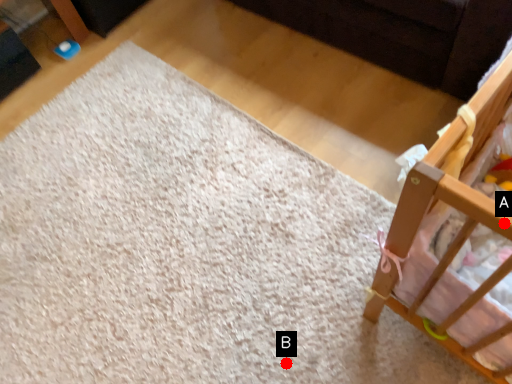
Question: Two points are circled on the image, labeled by A and B beside each circle. Which point is closer to the camera?

Choices:
 (A) A is closer
 (B) B is closer

Answer: (A)